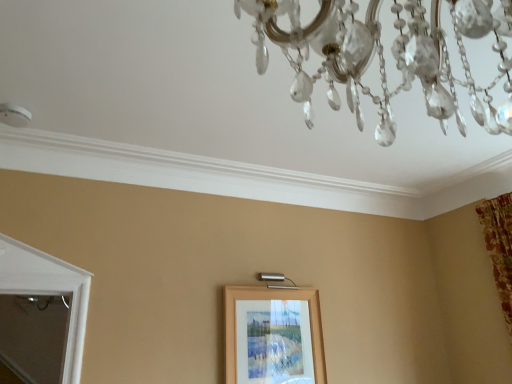
Question: Is wooden picture frame at center wider or thinner than clear crystal chandelier at upper center?

Choices:
 (A) wide
 (B) thin

Answer: (B)

Question: Does point (254, 357) appear closer or farther from the camera than point (312, 38)?

Choices:
 (A) farther
 (B) closer

Answer: (A)

Question: Considering the positions of wooden picture frame at center and clear crystal chandelier at upper center in the image, is wooden picture frame at center bigger or smaller than clear crystal chandelier at upper center?

Choices:
 (A) big
 (B) small

Answer: (B)

Question: Is clear crystal chandelier at upper center inside or outside of wooden picture frame at center?

Choices:
 (A) inside
 (B) outside

Answer: (B)

Question: Is point (428, 82) positioned closer to the camera than point (247, 322)?

Choices:
 (A) closer
 (B) farther

Answer: (A)

Question: Considering the positions of clear crystal chandelier at upper center and wooden picture frame at center in the image, is clear crystal chandelier at upper center bigger or smaller than wooden picture frame at center?

Choices:
 (A) small
 (B) big

Answer: (B)

Question: In the image, is clear crystal chandelier at upper center positioned in front of or behind wooden picture frame at center?

Choices:
 (A) front
 (B) behind

Answer: (A)